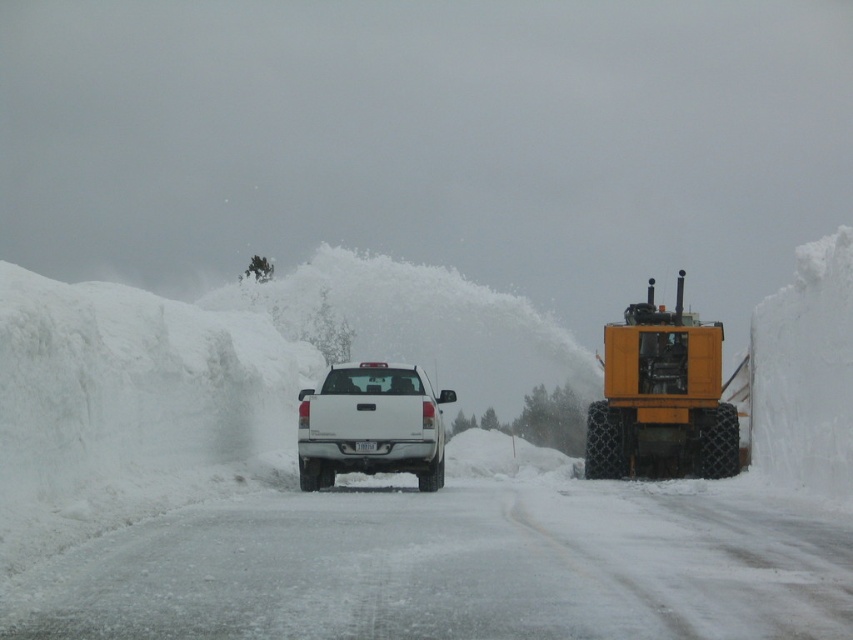
You are standing at the snowplow and want to move to the point at [410,440]. Which direction should you go relative to the point at [663,396]?

Since point [663,396] is further away from you, you should move towards the point [410,440] in the direction closer to the camera compared to point [663,396].

You are a delivery driver who needs to park your vehicle near the yellow rubber tractor at right without blocking the road. The white fluffy snow at center is in your way. Can you move the snow to the side?

The white fluffy snow at center is positioned on the left side of yellow rubber tractor at right, so you can move the snow to the left to make space for parking without blocking the road.

Consider the image. You are a delivery driver who needs to park your vehicle on the cleared road. The road is flanked by snowbanks on both sides. Given the presence of the white fluffy snow at center and the white matte truck at center, which object determines the maximum width you can safely park your vehicle without hitting the snowbanks?

The white fluffy snow at center has a larger width than the white matte truck at center. Therefore, the width of the white fluffy snow at center determines the maximum parking width, as it is the wider of the two and closer to the snowbanks.